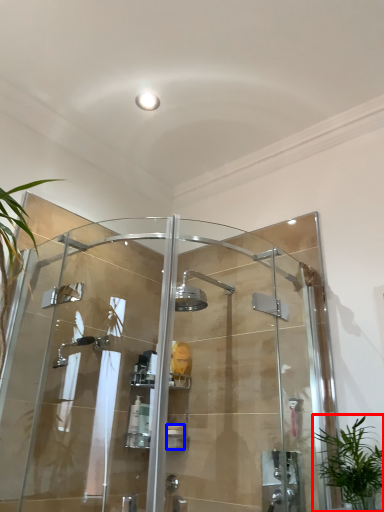
Question: Which object is further to the camera taking this photo, houseplant (highlighted by a red box) or toiletry (highlighted by a blue box)?

Choices:
 (A) houseplant
 (B) toiletry

Answer: (B)